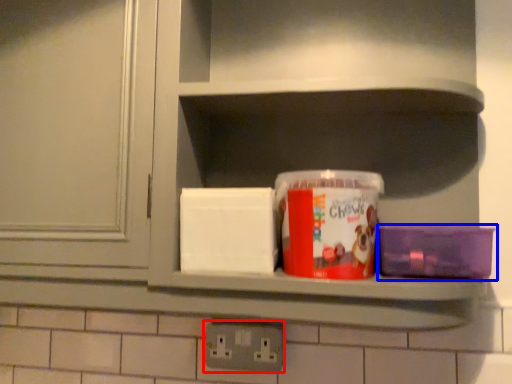
Question: Which object appears closest to the camera in this image, electric outlet (highlighted by a red box) or box (highlighted by a blue box)?

Choices:
 (A) electric outlet
 (B) box

Answer: (B)